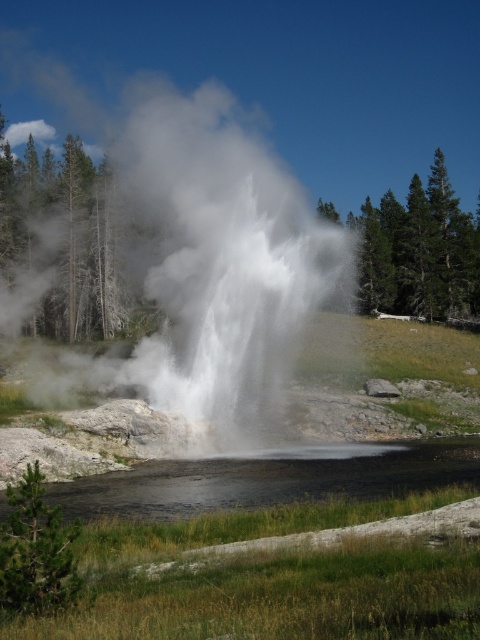
You are standing in front of the erupting geyser and want to place two markers at the coordinates point (200, 220) and point (163, 508). Which marker will be closer to you?

Point (200, 220) is further to the viewer than point (163, 508), so the marker at point (163, 508) will be closer to you.

You are a photographer standing at the edge of the geyser area. You want to capture a photo where the white vapor at center and black reflective water at lower center are both visible. Based on their positions, which object should you position closer to the left side of your frame?

The white vapor at center should be positioned closer to the left side of the frame since it is already located to the left of the black reflective water at lower center.

You are a photographer trying to capture the geyser eruption. You notice the white vapor at center and the black reflective water at lower center. Which object should you focus on to get the best shot of the erupting water column?

The white vapor at center is above the black reflective water at lower center, so focusing on the white vapor at center will capture the erupting water column as it rises above the water surface.